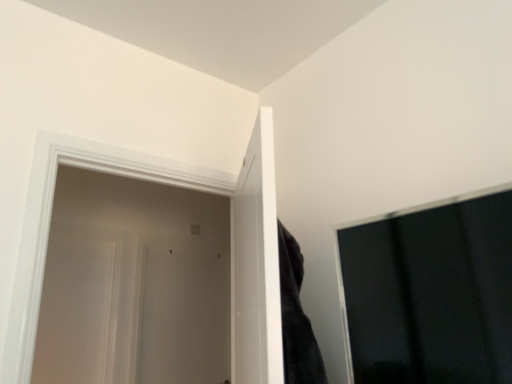
What is the approximate height of white glossy door at left, which appears as the second door when viewed from the back?

white glossy door at left, which appears as the second door when viewed from the back, is 34.41 inches tall.

Locate an element on the screen. This screenshot has height=384, width=512. white matte door at center, positioned as the 2th door in left-to-right order is located at coordinates (184, 317).

Looking at the image, does white matte door at center, which is the 2th door from right to left, seem bigger or smaller compared to white glossy door at left, the first door positioned from the front?

Clearly, white matte door at center, which is the 2th door from right to left, is smaller in size than white glossy door at left, the first door positioned from the front.

From a real-world perspective, relative to white glossy door at left, which is the third door in back-to-front order, is white matte door at center, which is the 2th door from right to left, vertically above or below?

white matte door at center, which is the 2th door from right to left, is situated lower than white glossy door at left, which is the third door in back-to-front order, in the real world.

Looking at this image, considering the sizes of white matte door at center, which is the 2th door from right to left, and white glossy door at left, the first door in the right-to-left sequence, in the image, is white matte door at center, which is the 2th door from right to left, wider or thinner than white glossy door at left, the first door in the right-to-left sequence,?

white matte door at center, which is the 2th door from right to left, is thinner than white glossy door at left, the first door in the right-to-left sequence.

Locate an element on the screen. The width and height of the screenshot is (512, 384). the 2nd door below when counting from the white glossy door at left, placed as the 3th door when sorted from left to right (from the image's perspective) is located at coordinates (184, 317).

Considering the relative positions of white matte door at center, positioned as the 2th door in left-to-right order, and white glossy door at left, which is the third door from right to left, in the image provided, is white matte door at center, positioned as the 2th door in left-to-right order, to the left of white glossy door at left, which is the third door from right to left, from the viewer's perspective?

In fact, white matte door at center, positioned as the 2th door in left-to-right order, is to the right of white glossy door at left, which is the third door from right to left.

Find the location of a particular element. Image resolution: width=512 pixels, height=384 pixels. door that is the 1st object located above the white matte door at center, which is the 2th door from right to left (from the image's perspective) is located at coordinates (74, 313).

Considering the relative sizes of white matte door at center, which is the 2th door from right to left, and white glossy door at left, which appears as the 1th door when viewed from the left, in the image provided, is white matte door at center, which is the 2th door from right to left, taller than white glossy door at left, which appears as the 1th door when viewed from the left,?

Yes.

Is white matte door at center, arranged as the 3th door when viewed from the front, not close to white glossy door at left, which is the third door from right to left?

white matte door at center, arranged as the 3th door when viewed from the front, is actually quite close to white glossy door at left, which is the third door from right to left.

Between white glossy door at left, which is the third door from right to left, and white glossy door at left, the first door in the right-to-left sequence, which one has smaller width?

With smaller width is white glossy door at left, which is the third door from right to left.

Is white glossy door at left, which appears as the second door when viewed from the back, outside of white glossy door at left, the first door in the right-to-left sequence?

Absolutely, white glossy door at left, which appears as the second door when viewed from the back, is external to white glossy door at left, the first door in the right-to-left sequence.

From the image's perspective, is white glossy door at left, the second door viewed from the front, beneath white glossy door at left, the first door in the right-to-left sequence?

Indeed, from the image's perspective, white glossy door at left, the second door viewed from the front, is shown beneath white glossy door at left, the first door in the right-to-left sequence.

Who is bigger, white glossy door at left, which is the third door in back-to-front order, or white matte door at center, positioned as the 2th door in left-to-right order?

Bigger between the two is white glossy door at left, which is the third door in back-to-front order.

Is white glossy door at left, the first door positioned from the front, looking in the opposite direction of white matte door at center, which is counted as the 1th door, starting from the back?

Yes, white glossy door at left, the first door positioned from the front, is facing away from white matte door at center, which is counted as the 1th door, starting from the back.

Consider the image. Is white glossy door at left, placed as the 3th door when sorted from left to right, outside of white matte door at center, which is counted as the 1th door, starting from the back?

Yes.

Is white glossy door at left, which is the third door in back-to-front order, wider than white matte door at center, positioned as the 2th door in left-to-right order?

Yes.

Visually, is white glossy door at left, the second door viewed from the front, positioned to the left or to the right of white matte door at center, arranged as the 3th door when viewed from the front?

Based on their positions, white glossy door at left, the second door viewed from the front, is located to the left of white matte door at center, arranged as the 3th door when viewed from the front.

Is white glossy door at left, which appears as the second door when viewed from the back, with white matte door at center, which is counted as the 1th door, starting from the back?

No, white glossy door at left, which appears as the second door when viewed from the back, is not in contact with white matte door at center, which is counted as the 1th door, starting from the back.

Where is `door on the left side of white matte door at center, which is counted as the 1th door, starting from the back`? door on the left side of white matte door at center, which is counted as the 1th door, starting from the back is located at coordinates (74, 313).

Could you tell me if white glossy door at left, the first door positioned from the front, is turned towards white glossy door at left, the second door viewed from the front?

No, white glossy door at left, the first door positioned from the front, is not facing towards white glossy door at left, the second door viewed from the front.

In terms of width, does white glossy door at left, the first door in the right-to-left sequence, look wider or thinner when compared to white glossy door at left, which appears as the 1th door when viewed from the left?

Clearly, white glossy door at left, the first door in the right-to-left sequence, has more width compared to white glossy door at left, which appears as the 1th door when viewed from the left.

Can you confirm if white glossy door at left, the first door in the right-to-left sequence, is positioned to the right of white glossy door at left, which appears as the 1th door when viewed from the left?

Correct, you'll find white glossy door at left, the first door in the right-to-left sequence, to the right of white glossy door at left, which appears as the 1th door when viewed from the left.

You are a GUI agent. You are given a task and a screenshot of the screen. Output one action in this format:
    pyautogui.click(x=<x>, y=<y>)
    Task: Click on the door that is the 2nd one when counting downward from the white glossy door at left, the first door in the right-to-left sequence (from the image's perspective)
    
    Given the screenshot: What is the action you would take?
    pyautogui.click(x=184, y=317)

Identify the location of door that is under the white glossy door at left, which is the third door from right to left (from a real-world perspective). This screenshot has width=512, height=384. (184, 317).

Considering their positions, is white glossy door at left, which is the third door in back-to-front order, positioned further to white glossy door at left, which appears as the second door when viewed from the back, than white matte door at center, positioned as the 2th door in left-to-right order?

The object further to white glossy door at left, which appears as the second door when viewed from the back, is white glossy door at left, which is the third door in back-to-front order.

From the image, which object appears to be nearer to white matte door at center, which is the 2th door from right to left, white glossy door at left, placed as the 3th door when sorted from left to right, or white glossy door at left, which appears as the 1th door when viewed from the left?

The object closer to white matte door at center, which is the 2th door from right to left, is white glossy door at left, which appears as the 1th door when viewed from the left.

Considering their positions, is white glossy door at left, which appears as the 1th door when viewed from the left, positioned closer to white glossy door at left, the first door positioned from the front, than white matte door at center, positioned as the 2th door in left-to-right order?

white glossy door at left, which appears as the 1th door when viewed from the left, is closer to white glossy door at left, the first door positioned from the front.

Based on their spatial positions, is white matte door at center, which is the 2th door from right to left, or white glossy door at left, which appears as the 1th door when viewed from the left, closer to white glossy door at left, placed as the 3th door when sorted from left to right?

The object closer to white glossy door at left, placed as the 3th door when sorted from left to right, is white glossy door at left, which appears as the 1th door when viewed from the left.

Based on their spatial positions, is white matte door at center, positioned as the 2th door in left-to-right order, or white glossy door at left, the first door in the right-to-left sequence, closer to white glossy door at left, which is the third door from right to left?

white matte door at center, positioned as the 2th door in left-to-right order, is positioned closer to the anchor white glossy door at left, which is the third door from right to left.

Estimate the real-world distances between objects in this image. Which object is further from white matte door at center, which is the 2th door from right to left, white glossy door at left, which appears as the second door when viewed from the back, or white glossy door at left, the first door positioned from the front?

Among the two, white glossy door at left, the first door positioned from the front, is located further to white matte door at center, which is the 2th door from right to left.

Locate an element on the screen. This screenshot has width=512, height=384. door located between white glossy door at left, which is the third door in back-to-front order, and white matte door at center, arranged as the 3th door when viewed from the front, in the depth direction is located at coordinates (74, 313).